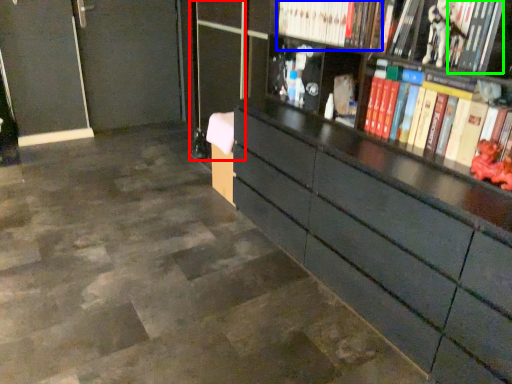
Question: Based on their relative distances, which object is nearer to glass door (highlighted by a red box)? Choose from book (highlighted by a blue box) and book (highlighted by a green box).

Choices:
 (A) book
 (B) book

Answer: (A)